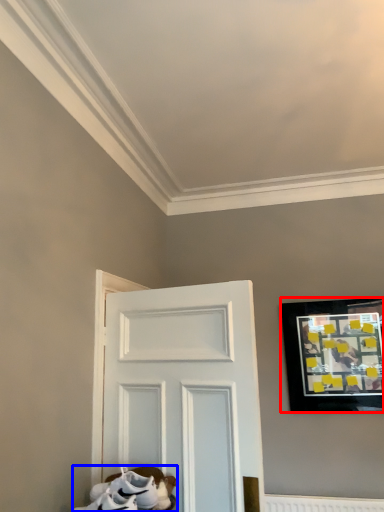
Question: Which object appears closest to the camera in this image, picture frame (highlighted by a red box) or footwear (highlighted by a blue box)?

Choices:
 (A) picture frame
 (B) footwear

Answer: (B)